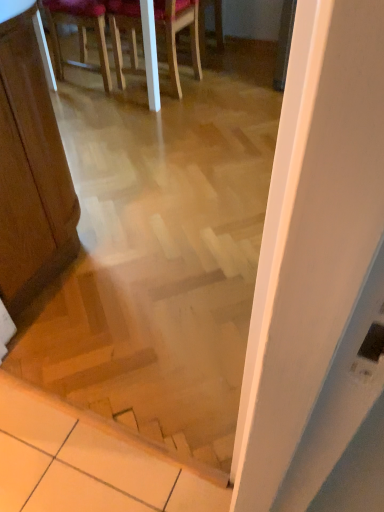
At what (x,y) coordinates should I click in order to perform the action: click on vacant area located to the right-hand side of wooden stairs at center. Please return your answer as a coordinate pair (x, y). This screenshot has width=384, height=512. Looking at the image, I should click on (185, 370).